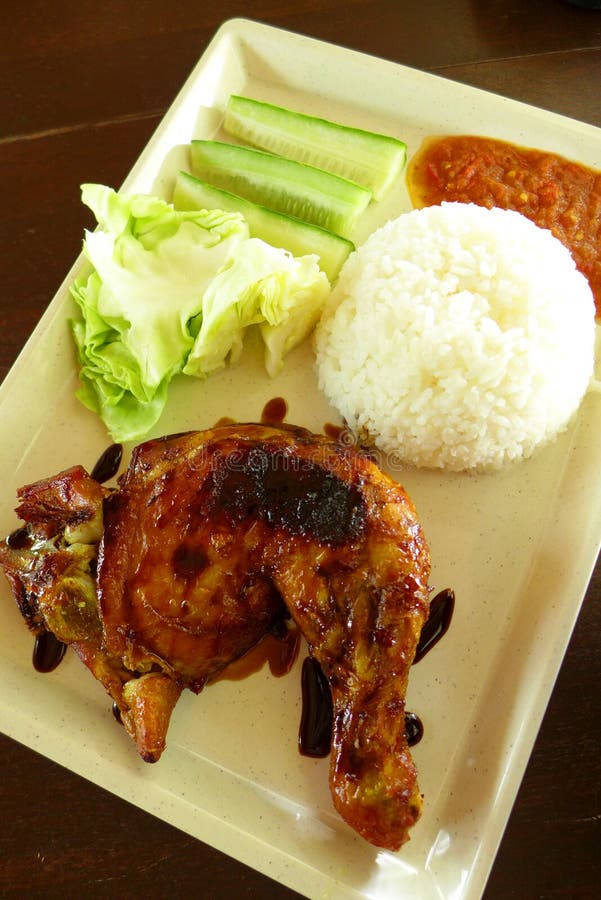
Locate an element on the screen. This screenshot has height=900, width=601. white grain in the wood table is located at coordinates (43, 857), (139, 869), (579, 816).